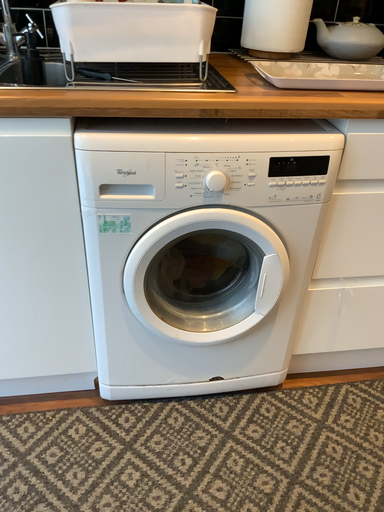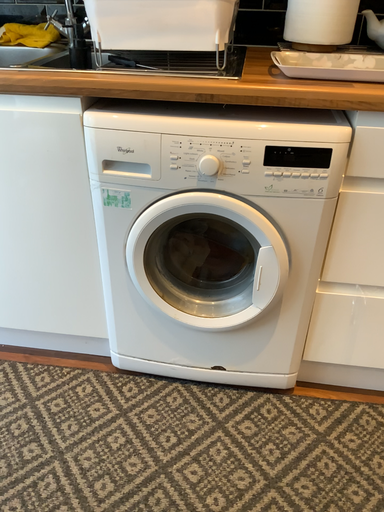
Question: How did the camera likely rotate when shooting the video?

Choices:
 (A) rotated left
 (B) rotated right

Answer: (A)